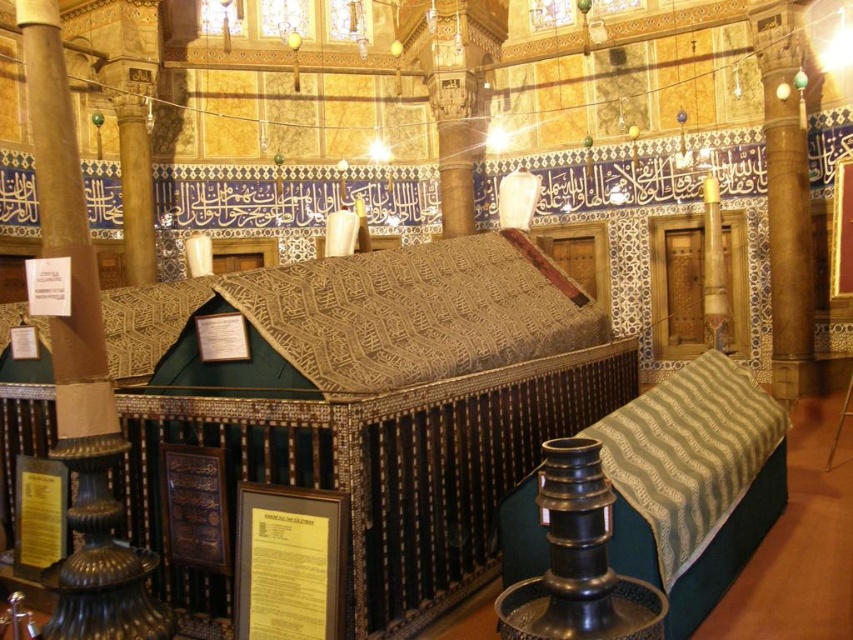
In the scene shown: Is polished marble pillar at center thinner than white marble column at right?

A: Yes, polished marble pillar at center is thinner than white marble column at right.

Does polished marble pillar at center have a lesser height compared to white marble column at right?

In fact, polished marble pillar at center may be taller than white marble column at right.

Is point (35, 147) in front of point (712, 176)?

That is True.

Locate an element on the screen. This screenshot has height=640, width=853. polished marble pillar at center is located at coordinates (80, 369).

Does wooden column at right have a smaller size compared to white marble column at right?

Yes, wooden column at right is smaller than white marble column at right.

Between wooden column at right and white marble column at right, which one appears on the right side from the viewer's perspective?

Positioned to the right is wooden column at right.

Does point (799, 61) come closer to viewer compared to point (712, 173)?

Yes, point (799, 61) is in front of point (712, 173).

Locate an element on the screen. The height and width of the screenshot is (640, 853). wooden column at right is located at coordinates (786, 200).

Which is below, polished marble pillar at center or wooden column at right?

polished marble pillar at center is below.

Can you confirm if polished marble pillar at center is bigger than wooden column at right?

No, polished marble pillar at center is not bigger than wooden column at right.

Is point (143, 552) farther from viewer compared to point (779, 150)?

No, (143, 552) is closer to viewer.

This screenshot has width=853, height=640. Find the location of `polished marble pillar at center`. polished marble pillar at center is located at coordinates (80, 369).